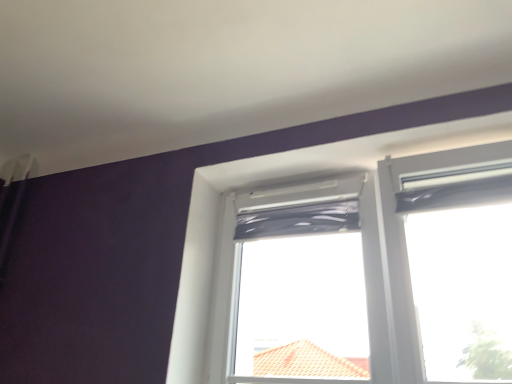
In order to face transparent plastic window at upper center, should I rotate leftwards or rightwards?

Turn right by 13.154 degrees to look at transparent plastic window at upper center.

In the scene shown: What is the approximate height of transparent plastic window at upper center?

It is 33.02 inches.

Image resolution: width=512 pixels, height=384 pixels. What do you see at coordinates (376, 275) in the screenshot?
I see `transparent plastic window at upper center` at bounding box center [376, 275].

The height and width of the screenshot is (384, 512). What are the coordinates of `transparent plastic window at upper center` in the screenshot? It's located at (376, 275).

You are a GUI agent. You are given a task and a screenshot of the screen. Output one action in this format:
    pyautogui.click(x=<x>, y=<y>)
    Task: Click on the transparent plastic window at upper center
    
    Given the screenshot: What is the action you would take?
    pyautogui.click(x=376, y=275)